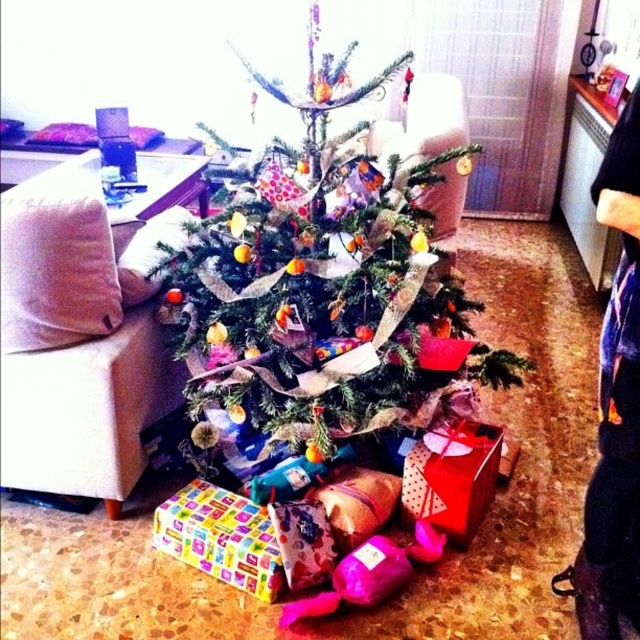
Question: Is multicolored paper wrapped gift at lower center positioned at the back of shiny red gift at lower center?

Choices:
 (A) no
 (B) yes

Answer: (A)

Question: Does dark blue jeans at lower right come in front of multicolored paper wrapped gift at lower center?

Choices:
 (A) yes
 (B) no

Answer: (A)

Question: Which point appears farthest from the camera in this image?

Choices:
 (A) (472, 451)
 (B) (173, 513)
 (C) (232, 184)
 (D) (620, 150)

Answer: (C)

Question: Based on their relative distances, which object is farther from the multicolored paper wrapped gift at lower center?

Choices:
 (A) shiny red gift at lower center
 (B) dark blue jeans at lower right
 (C) green matte christmas tree at center

Answer: (B)

Question: Does dark blue jeans at lower right appear on the left side of shiny red gift at lower center?

Choices:
 (A) no
 (B) yes

Answer: (A)

Question: Which point is farther to the camera?

Choices:
 (A) click(276, 554)
 (B) click(179, 260)
 (C) click(625, 502)
 (D) click(417, 515)

Answer: (D)